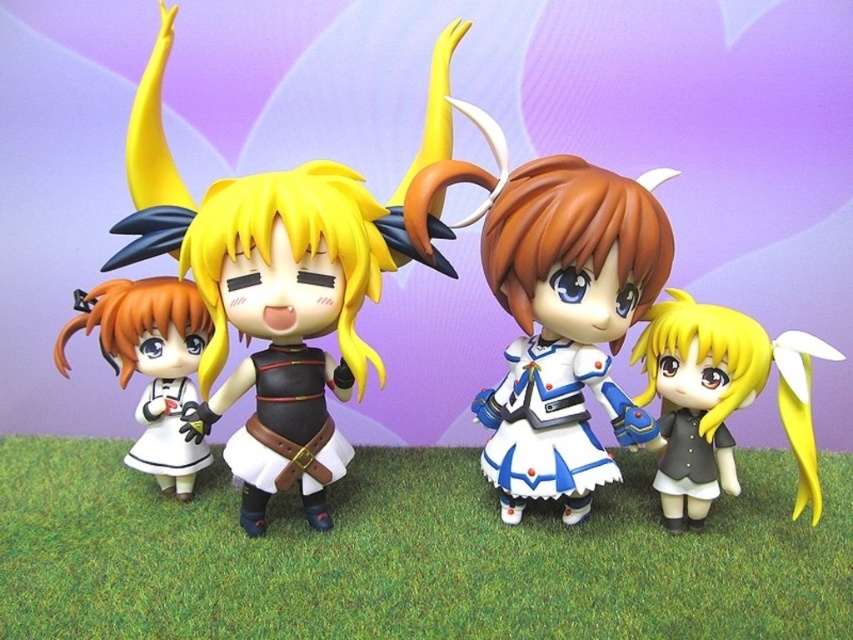
Question: Which object appears farthest from the camera in this image?

Choices:
 (A) matte black dress at center
 (B) matte white dress at left
 (C) green grass at lower center
 (D) matte black doll at center

Answer: (B)

Question: Can you confirm if matte black doll at center is thinner than satin white dress at center?

Choices:
 (A) yes
 (B) no

Answer: (B)

Question: Which point is closer to the camera?

Choices:
 (A) (296, 195)
 (B) (831, 540)

Answer: (A)

Question: Is satin white dress at center below matte white dress at left?

Choices:
 (A) no
 (B) yes

Answer: (A)

Question: Can you confirm if matte black doll at center is smaller than matte black dress at center?

Choices:
 (A) yes
 (B) no

Answer: (B)

Question: Which point is farther to the camera?

Choices:
 (A) green grass at lower center
 (B) matte white dress at left
 (C) satin white dress at center

Answer: (B)